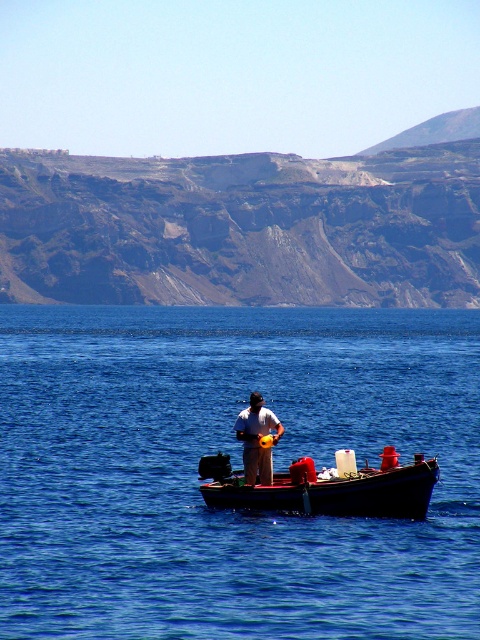
Question: Considering the real-world distances, which object is closest to the wooden boat at center?

Choices:
 (A) blue water at center
 (B) matte yellow helmet at center

Answer: (B)

Question: Can you confirm if wooden boat at center is positioned to the left of matte yellow helmet at center?

Choices:
 (A) no
 (B) yes

Answer: (A)

Question: Which point is closer to the camera?

Choices:
 (A) matte yellow helmet at center
 (B) blue water at center
 (C) wooden boat at center

Answer: (B)

Question: Does blue water at center have a larger size compared to matte yellow helmet at center?

Choices:
 (A) yes
 (B) no

Answer: (A)

Question: Estimate the real-world distances between objects in this image. Which object is closer to the wooden boat at center?

Choices:
 (A) blue water at center
 (B) matte yellow helmet at center

Answer: (B)

Question: Is blue water at center below matte yellow helmet at center?

Choices:
 (A) yes
 (B) no

Answer: (B)